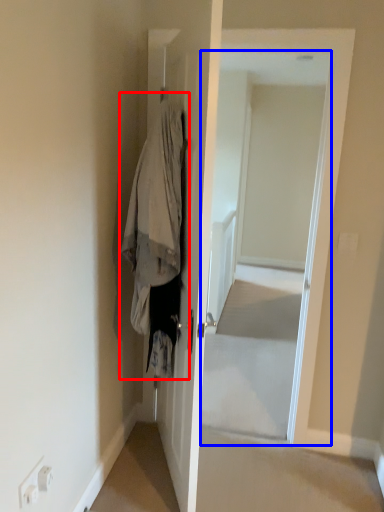
Question: Which object appears farthest to the camera in this image, clothing (highlighted by a red box) or screen door (highlighted by a blue box)?

Choices:
 (A) clothing
 (B) screen door

Answer: (B)